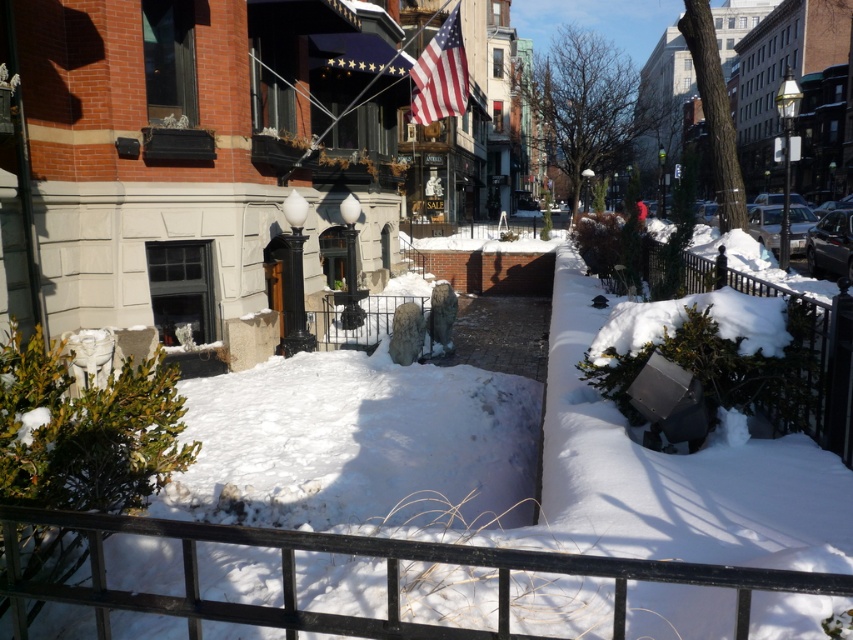
Question: Does black metal fence at lower center come behind american flag at upper center?

Choices:
 (A) yes
 (B) no

Answer: (B)

Question: Is black metal fence at lower center wider than american flag at upper center?

Choices:
 (A) no
 (B) yes

Answer: (B)

Question: Which point appears closest to the camera in this image?

Choices:
 (A) (416, 61)
 (B) (370, 630)

Answer: (B)

Question: Which point is farther from the camera taking this photo?

Choices:
 (A) (453, 76)
 (B) (25, 611)

Answer: (A)

Question: Which object is closer to the camera taking this photo?

Choices:
 (A) black metal fence at lower center
 (B) american flag at upper center

Answer: (A)

Question: Can you confirm if black metal fence at lower center is thinner than american flag at upper center?

Choices:
 (A) no
 (B) yes

Answer: (A)